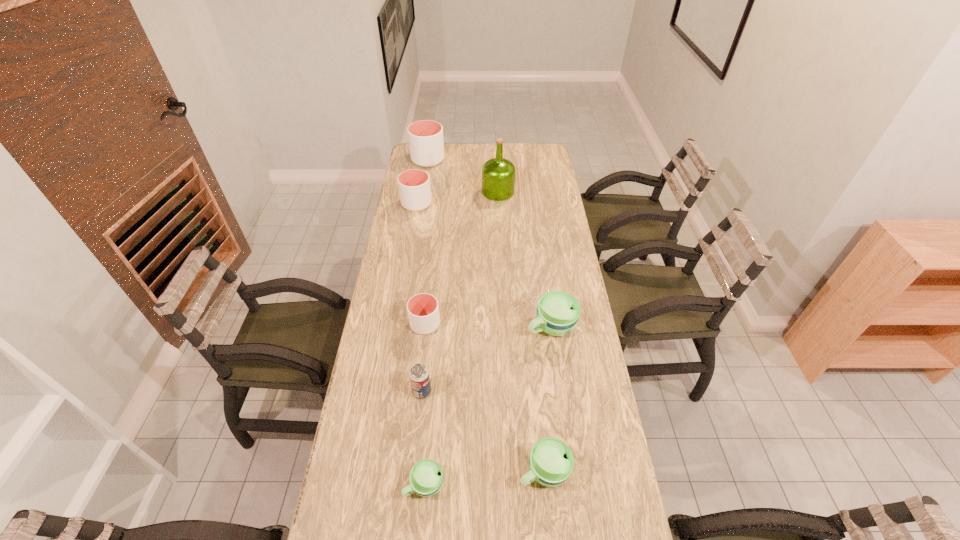
Locate an element on the screen. the second shortest object is located at coordinates (551, 462).

Where is `the second biggest blue cup`? The height and width of the screenshot is (540, 960). the second biggest blue cup is located at coordinates (551, 462).

Locate an element on the screen. This screenshot has height=540, width=960. the shortest cup is located at coordinates (426, 477).

Find the location of a particular element. the shortest object is located at coordinates (426, 477).

What are the coordinates of `free point located 0.050m on the right of the olive oil` in the screenshot? It's located at (524, 192).

Find the location of a particular element. The height and width of the screenshot is (540, 960). free region located on the right of the farthest white cup is located at coordinates (482, 160).

Where is `vacant point located 0.170m on the back of the second smallest white cup`? Image resolution: width=960 pixels, height=540 pixels. vacant point located 0.170m on the back of the second smallest white cup is located at coordinates (421, 175).

Where is `vacant region located on the left of the beer can`? vacant region located on the left of the beer can is located at coordinates (384, 392).

The width and height of the screenshot is (960, 540). What are the coordinates of `free space located on the front of the biggest blue cup` in the screenshot? It's located at (564, 417).

Image resolution: width=960 pixels, height=540 pixels. I want to click on vacant area situated 0.210m on the back of the smallest white cup, so click(x=431, y=272).